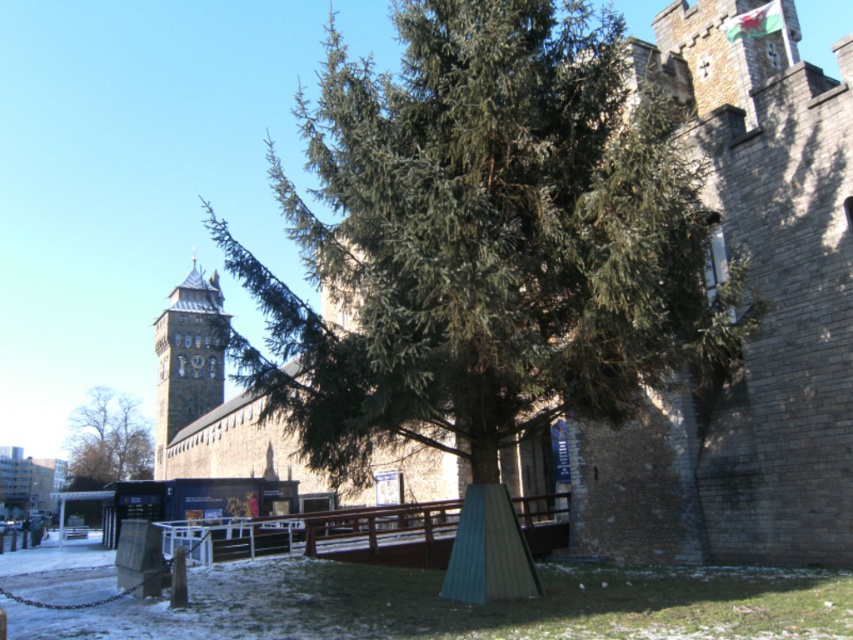
You are standing at point A at point [160,435] and want to reach point B, which is 514.46 feet away. The path between them is clear except for the large evergreen tree in the foreground. Can you walk around the tree to reach point B without going through the tree?

The path between point A at point [160,435] and point B is clear except for the large evergreen tree in the foreground. Since the tree is in the foreground, you can walk around it to reach point B without going through the tree.

You are standing in the winter scene with the large evergreen tree and the historic stone building. You notice two points marked in the image. The first point is at coordinates point (171, 326) and the second is at point (115, 468). From your perspective, which point is closer to you?

Point (171, 326) is in front of point (115, 468), so it is closer to you.